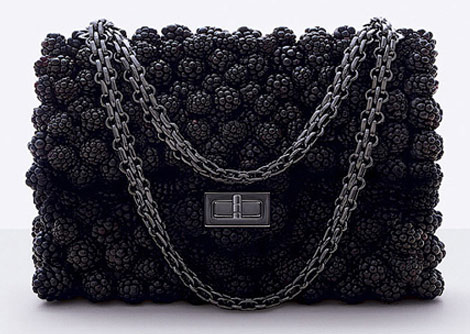
Identify the location of white wall. Image resolution: width=470 pixels, height=334 pixels. (22, 114).